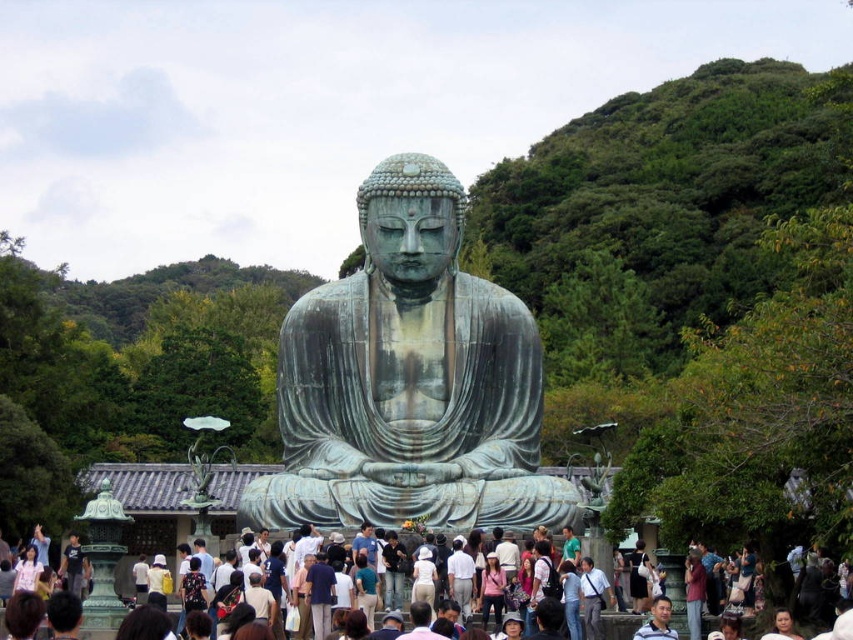
Between light blue shirt at lower center and dark blue jeans at center, which one is positioned lower?

light blue shirt at lower center is lower down.

Where is `light blue shirt at lower center`? light blue shirt at lower center is located at coordinates (592, 596).

This screenshot has width=853, height=640. I want to click on light blue shirt at lower center, so click(x=592, y=596).

Which is in front, point (636, 596) or point (32, 552)?

Point (636, 596) is more forward.

Is white cotton shirt at center bigger than pink fabric at lower left?

Correct, white cotton shirt at center is larger in size than pink fabric at lower left.

Between point (646, 577) and point (33, 576), which one is positioned in front?

Point (646, 577) is in front.

Where is `white cotton shirt at center`? Image resolution: width=853 pixels, height=640 pixels. white cotton shirt at center is located at coordinates (639, 577).

Can you confirm if matte bronze statue at center is smaller than dark blue jeans at center?

No, matte bronze statue at center is not smaller than dark blue jeans at center.

Is matte bronze statue at center bigger than dark blue jeans at center?

Yes.

What do you see at coordinates (619, 625) in the screenshot? The width and height of the screenshot is (853, 640). I see `matte bronze statue at center` at bounding box center [619, 625].

Where is `matte bronze statue at center`? The width and height of the screenshot is (853, 640). matte bronze statue at center is located at coordinates (619, 625).